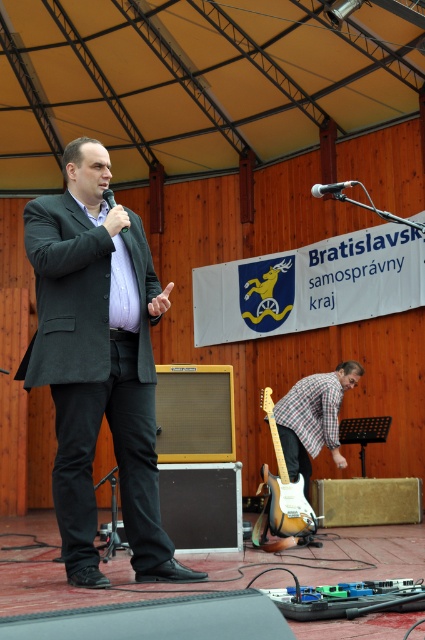
Question: Does matte black suit at center appear on the right side of sunburst wood electric guitar at lower center?

Choices:
 (A) yes
 (B) no

Answer: (B)

Question: Which point is farther to the camera?

Choices:
 (A) (110, 205)
 (B) (350, 186)
 (C) (309, 520)
 (D) (68, 266)

Answer: (C)

Question: Which point is closer to the camera?

Choices:
 (A) metallic silver microphone at upper center
 (B) sunburst wood electric guitar at lower center

Answer: (A)

Question: Is matte black suit at center positioned behind metallic silver microphone at upper center?

Choices:
 (A) yes
 (B) no

Answer: (B)

Question: Can you confirm if metallic silver microphone at upper center is positioned to the right of matte black microphone at upper center?

Choices:
 (A) no
 (B) yes

Answer: (B)

Question: Which point is closer to the camera?

Choices:
 (A) (104, 198)
 (B) (90, 538)

Answer: (B)